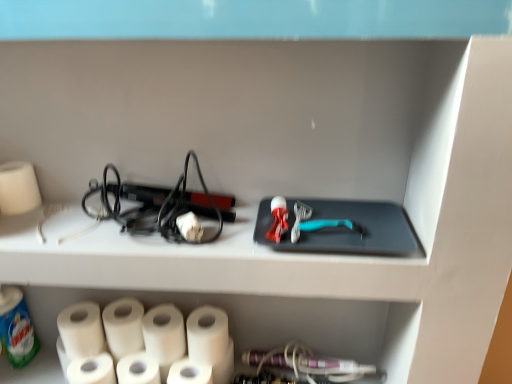
Question: Considering the relative sizes of white matte paper towel at lower left, which is the 5th paper towel in right-to-left order, and white matte toilet paper at lower left in the image provided, is white matte paper towel at lower left, which is the 5th paper towel in right-to-left order, shorter than white matte toilet paper at lower left?

Choices:
 (A) yes
 (B) no

Answer: (B)

Question: From the image's perspective, is white matte paper towel at lower left, which is the 5th paper towel in right-to-left order, located beneath white matte toilet paper at lower left?

Choices:
 (A) no
 (B) yes

Answer: (A)

Question: Considering the relative positions of white matte paper towel at lower left, which is the 5th paper towel in right-to-left order, and white matte toilet paper at lower left in the image provided, is white matte paper towel at lower left, which is the 5th paper towel in right-to-left order, to the right of white matte toilet paper at lower left from the viewer's perspective?

Choices:
 (A) no
 (B) yes

Answer: (B)

Question: Is white matte paper towel at lower left, the 3th paper towel positioned from the left, turned away from white matte toilet paper at lower left?

Choices:
 (A) no
 (B) yes

Answer: (A)

Question: Would you consider white matte paper towel at lower left, the 3th paper towel positioned from the left, to be distant from white matte toilet paper at lower left?

Choices:
 (A) no
 (B) yes

Answer: (A)

Question: From the image's perspective, is white matte toilet paper at lower left positioned above or below white matte paper towel at lower left, marked as the 6th paper towel in a right-to-left arrangement?

Choices:
 (A) above
 (B) below

Answer: (B)

Question: Is white matte toilet paper at lower left in front of or behind white matte paper towel at lower left, marked as the 6th paper towel in a right-to-left arrangement, in the image?

Choices:
 (A) front
 (B) behind

Answer: (A)

Question: Is white matte toilet paper at lower left wider or thinner than white matte paper towel at lower left, which is the 2th paper towel in left-to-right order?

Choices:
 (A) wide
 (B) thin

Answer: (B)

Question: Is white matte toilet paper at lower left situated inside white matte paper towel at lower left, marked as the 6th paper towel in a right-to-left arrangement, or outside?

Choices:
 (A) outside
 (B) inside

Answer: (A)

Question: Is white matte paper towel at lower center, which ranks as the second paper towel in right-to-left order, wider or thinner than white matte paper towel at left, the 1th paper towel from the left?

Choices:
 (A) wide
 (B) thin

Answer: (A)

Question: Is point (194, 375) positioned closer to the camera than point (7, 183)?

Choices:
 (A) closer
 (B) farther

Answer: (B)

Question: Is white matte paper towel at lower center, which ranks as the second paper towel in right-to-left order, inside the boundaries of white matte paper towel at left, the 1th paper towel from the left, or outside?

Choices:
 (A) inside
 (B) outside

Answer: (B)

Question: From the image's perspective, is white matte paper towel at lower center, the 6th paper towel viewed from the left, located above or below white matte paper towel at left, acting as the 7th paper towel starting from the right?

Choices:
 (A) above
 (B) below

Answer: (B)

Question: Is point (108, 379) positioned closer to the camera than point (176, 379)?

Choices:
 (A) closer
 (B) farther

Answer: (B)

Question: Would you say white matte toilet paper at lower left is to the left or to the right of white matte paper towel at lower center, the 6th paper towel viewed from the left, in the picture?

Choices:
 (A) right
 (B) left

Answer: (B)